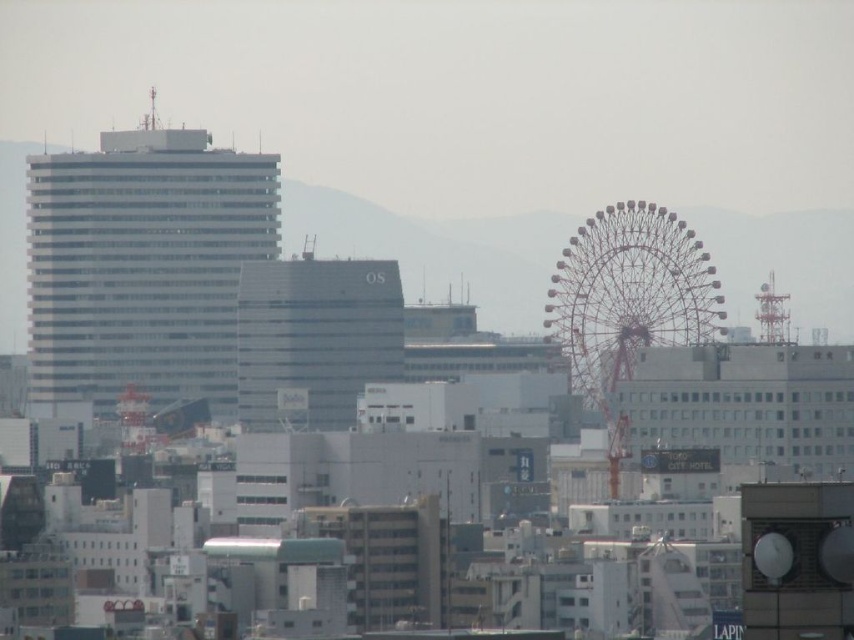
Is white glass building at left bigger than metallic silver ferris wheel at right?

Indeed, white glass building at left has a larger size compared to metallic silver ferris wheel at right.

From the picture: Which is above, white glass building at left or metallic silver ferris wheel at right?

white glass building at left is higher up.

Describe the element at coordinates (143, 266) in the screenshot. This screenshot has height=640, width=854. I see `white glass building at left` at that location.

What are the coordinates of `white glass building at left` in the screenshot? It's located at (143, 266).

Who is higher up, matte gray building at center or metallic silver ferris wheel at right?

Positioned higher is metallic silver ferris wheel at right.

Measure the distance between point (247,376) and camera.

Point (247,376) is 653.41 meters from camera.

The width and height of the screenshot is (854, 640). In order to click on matte gray building at center in this screenshot , I will do click(314, 339).

Who is positioned more to the left, white glass building at left or matte gray building at center?

white glass building at left is more to the left.

Is the position of white glass building at left more distant than that of matte gray building at center?

Yes, white glass building at left is further from the viewer.

Locate an element on the screen. white glass building at left is located at coordinates (143, 266).